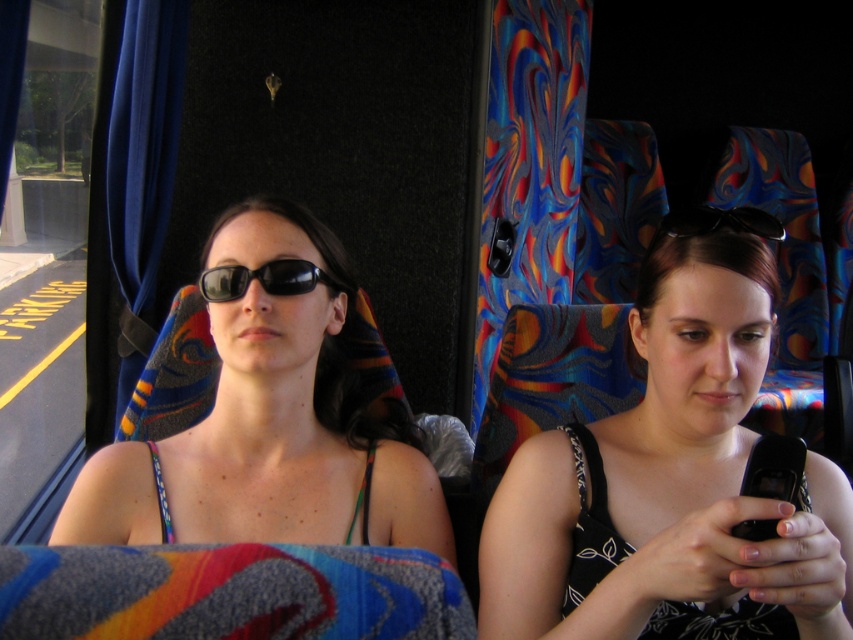
Can you confirm if black fabric phone at center is positioned to the left of black matte sunglasses at center?

No, black fabric phone at center is not to the left of black matte sunglasses at center.

Which of these two, black fabric phone at center or black matte sunglasses at center, stands shorter?

black matte sunglasses at center is shorter.

You are a GUI agent. You are given a task and a screenshot of the screen. Output one action in this format:
    pyautogui.click(x=<x>, y=<y>)
    Task: Click on the black fabric phone at center
    This screenshot has width=853, height=640.
    Given the screenshot: What is the action you would take?
    pyautogui.click(x=670, y=484)

Who is shorter, matte black sunglasses at center or black plastic sunglasses at upper center?

With less height is black plastic sunglasses at upper center.

Describe the element at coordinates (267, 426) in the screenshot. The height and width of the screenshot is (640, 853). I see `matte black sunglasses at center` at that location.

You are a GUI agent. You are given a task and a screenshot of the screen. Output one action in this format:
    pyautogui.click(x=<x>, y=<y>)
    Task: Click on the matte black sunglasses at center
    
    Given the screenshot: What is the action you would take?
    [x=267, y=426]

You are a GUI agent. You are given a task and a screenshot of the screen. Output one action in this format:
    pyautogui.click(x=<x>, y=<y>)
    Task: Click on the matte black sunglasses at center
    This screenshot has width=853, height=640.
    Given the screenshot: What is the action you would take?
    pyautogui.click(x=267, y=426)

Between black fabric phone at center and matte black sunglasses at center, which one has more height?

With more height is matte black sunglasses at center.

Which is below, black fabric phone at center or matte black sunglasses at center?

black fabric phone at center is below.

Which is in front, point (668, 625) or point (286, 362)?

Point (668, 625) is more forward.

Find the location of a particular element. The height and width of the screenshot is (640, 853). black fabric phone at center is located at coordinates (670, 484).